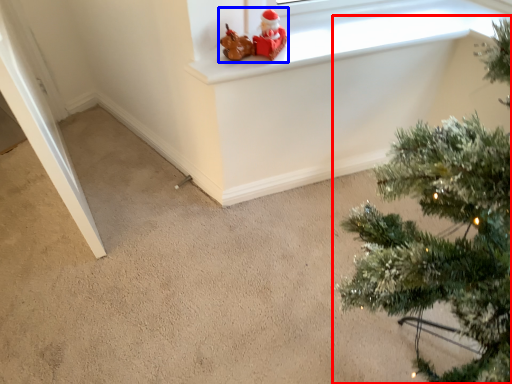
Question: Which object is further to the camera taking this photo, christmas tree (highlighted by a red box) or toy (highlighted by a blue box)?

Choices:
 (A) christmas tree
 (B) toy

Answer: (B)